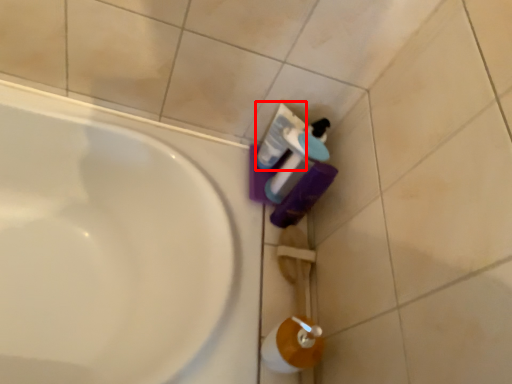
Question: Considering the relative positions of mouthwash (annotated by the red box) and cleaning product in the image provided, where is mouthwash (annotated by the red box) located with respect to the staircase?

Choices:
 (A) right
 (B) left

Answer: (B)